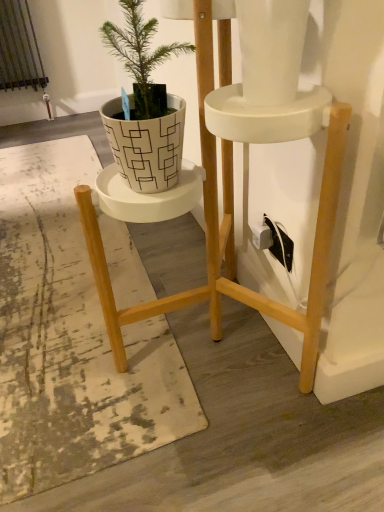
Question: In terms of size, does white textured mat at center appear bigger or smaller than white geometric-patterned pot at center-left?

Choices:
 (A) small
 (B) big

Answer: (B)

Question: Is white textured mat at center inside the boundaries of white geometric-patterned pot at center-left, or outside?

Choices:
 (A) inside
 (B) outside

Answer: (B)

Question: Would you say white textured mat at center is to the left or to the right of white geometric-patterned pot at center-left in the picture?

Choices:
 (A) left
 (B) right

Answer: (A)

Question: Is white geometric-patterned pot at center-left bigger or smaller than white textured mat at center?

Choices:
 (A) small
 (B) big

Answer: (A)

Question: Considering their positions, is white geometric-patterned pot at center-left located in front of or behind white textured mat at center?

Choices:
 (A) front
 (B) behind

Answer: (A)

Question: In terms of width, does white geometric-patterned pot at center-left look wider or thinner when compared to white textured mat at center?

Choices:
 (A) wide
 (B) thin

Answer: (B)

Question: Considering the positions of white geometric-patterned pot at center-left and white textured mat at center in the image, is white geometric-patterned pot at center-left taller or shorter than white textured mat at center?

Choices:
 (A) tall
 (B) short

Answer: (A)